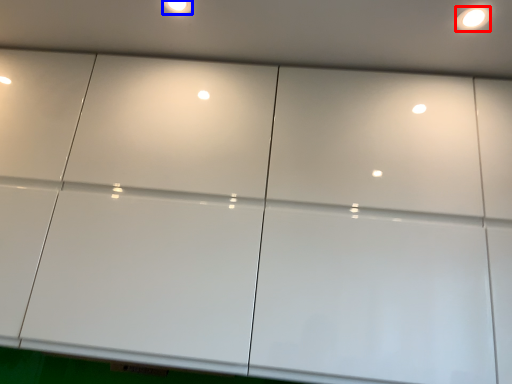
Question: Which object is closer to the camera taking this photo, light (highlighted by a red box) or dot (highlighted by a blue box)?

Choices:
 (A) light
 (B) dot

Answer: (A)